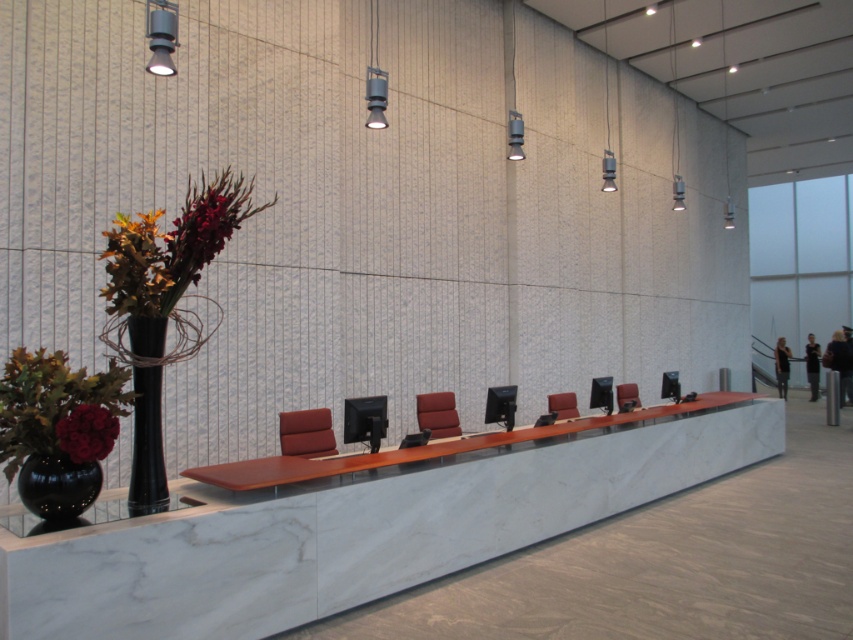
You are a visitor entering the room and need to find the matte brown leather chair at center. You see the matte black vase at lower left. Where should you look relative to the vase to find the chair?

The matte brown leather chair at center is below the matte black vase at lower left because the vase is located above the chair.

You are organizing a meeting in this space and need to place a large document on the desk. The document is as big as the matte red leather chair at center. Will the matte black vase at lower left be able to hold it?

The matte black vase at lower left has a smaller size compared to matte red leather chair at center, so it cannot hold the large document since it is smaller than the chair.

You are organizing a meeting in this space and need to place a large banner that requires 2 meters of width. You have the white marble table at center and the black glossy vase at lower left. Which object can accommodate the banner based on their widths?

The white marble table at center is wider than the black glossy vase at lower left, so the banner can be placed on the white marble table at center.